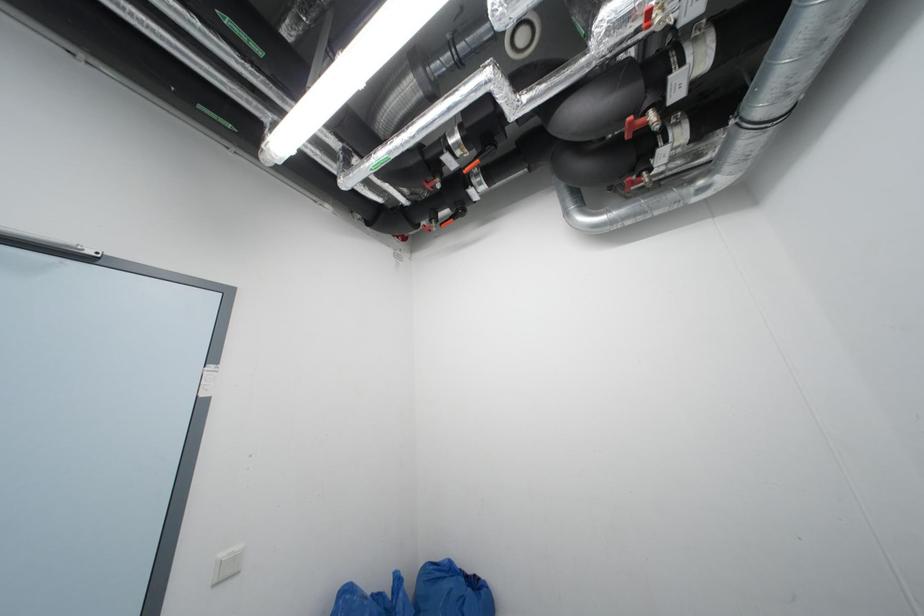
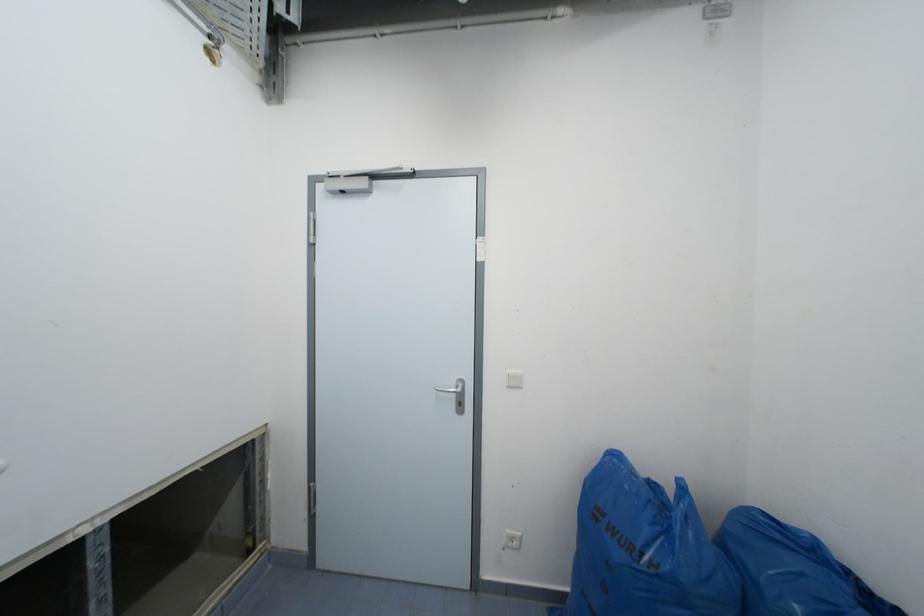
Question: The camera is either moving clockwise (left) or counter-clockwise (right) around the object. The first image is from the beginning of the video and the second image is from the end. Is the camera moving left or right when shooting the video?

Choices:
 (A) Left
 (B) Right

Answer: (B)